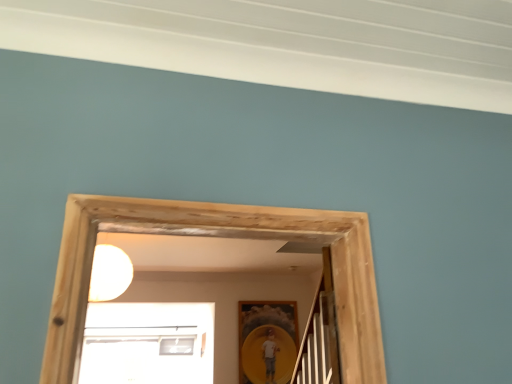
Question: Looking at the image, does matte yellow picture frame at center seem bigger or smaller compared to white matte light bulb at upper center?

Choices:
 (A) small
 (B) big

Answer: (A)

Question: In terms of width, does matte yellow picture frame at center look wider or thinner when compared to white matte light bulb at upper center?

Choices:
 (A) thin
 (B) wide

Answer: (A)

Question: From the image's perspective, is matte yellow picture frame at center above or below white matte light bulb at upper center?

Choices:
 (A) above
 (B) below

Answer: (B)

Question: Is white matte light bulb at upper center taller or shorter than matte yellow picture frame at center?

Choices:
 (A) short
 (B) tall

Answer: (A)

Question: From a real-world perspective, is white matte light bulb at upper center above or below matte yellow picture frame at center?

Choices:
 (A) above
 (B) below

Answer: (A)

Question: Looking at their shapes, would you say white matte light bulb at upper center is wider or thinner than matte yellow picture frame at center?

Choices:
 (A) wide
 (B) thin

Answer: (A)

Question: Based on their sizes in the image, would you say white matte light bulb at upper center is bigger or smaller than matte yellow picture frame at center?

Choices:
 (A) big
 (B) small

Answer: (A)